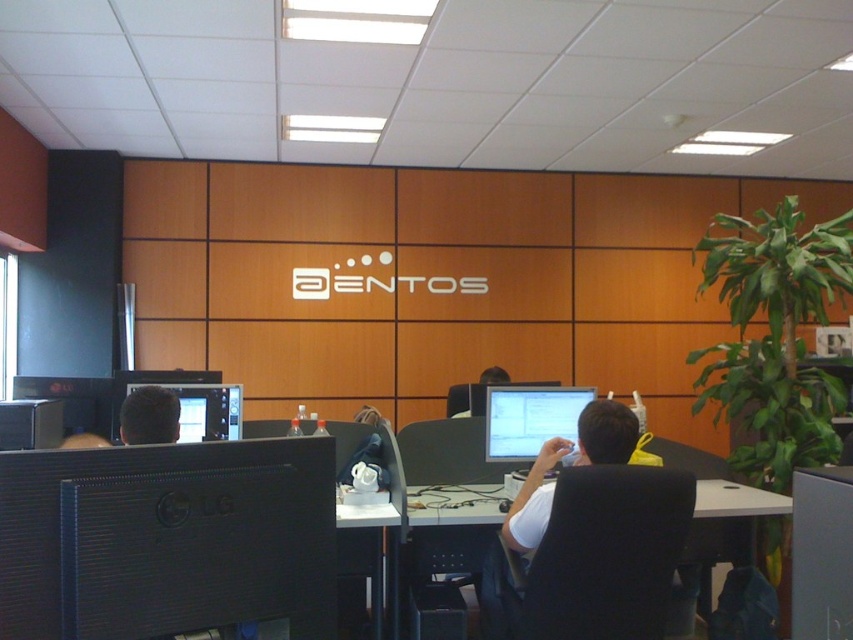
Question: Is black glossy monitor at lower left wider than matte black monitor at center?

Choices:
 (A) no
 (B) yes

Answer: (A)

Question: Which of the following is the farthest from the observer?

Choices:
 (A) matte black monitor at center
 (B) white plastic table at center

Answer: (A)

Question: Which point is closer to the camera taking this photo?

Choices:
 (A) (198, 563)
 (B) (238, 417)
 (C) (561, 396)

Answer: (A)

Question: Does black glossy monitor at lower left appear under matte black monitor at left?

Choices:
 (A) yes
 (B) no

Answer: (A)

Question: Considering the real-world distances, which object is closest to the matte black monitor at center?

Choices:
 (A) black glossy monitor at lower left
 (B) matte black monitor at left
 (C) white plastic table at center

Answer: (C)

Question: Can you confirm if white plastic table at center is positioned to the left of matte black monitor at left?

Choices:
 (A) no
 (B) yes

Answer: (A)